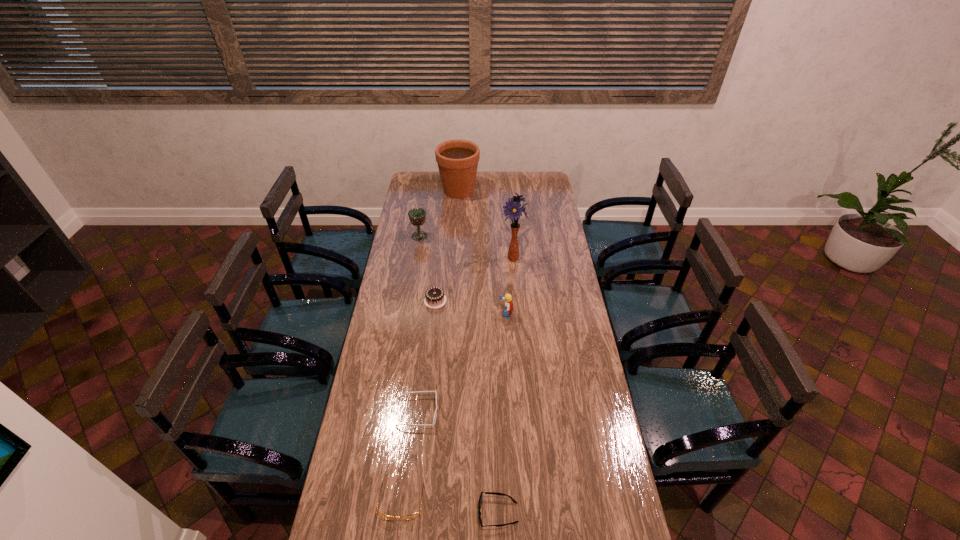
Identify the location of spectacles. (412, 516).

At what (x,y) coordinates should I click in order to perform the action: click on the right sunglasses. Please return your answer as a coordinate pair (x, y). Image resolution: width=960 pixels, height=540 pixels. Looking at the image, I should click on (494, 493).

Locate an element on the screen. This screenshot has height=540, width=960. the shortest object is located at coordinates (494, 493).

This screenshot has width=960, height=540. I want to click on vacant region located 0.100m on the back of the tallest object, so click(512, 237).

Locate an element on the screen. Image resolution: width=960 pixels, height=540 pixels. vacant space located on the left of the second tallest object is located at coordinates (428, 191).

Identify the location of vacant space located 0.090m on the front of the sixth shortest object. The image size is (960, 540). (417, 253).

The height and width of the screenshot is (540, 960). Find the location of `vacant region located on the front-facing side of the Lego`. vacant region located on the front-facing side of the Lego is located at coordinates (428, 314).

Where is `free space located on the front-facing side of the Lego`? Image resolution: width=960 pixels, height=540 pixels. free space located on the front-facing side of the Lego is located at coordinates (458, 314).

Locate an element on the screen. This screenshot has height=540, width=960. vacant space located on the front-facing side of the Lego is located at coordinates (420, 314).

Find the location of a particular element. This screenshot has width=960, height=540. vacant position located on the back of the chocolate cake is located at coordinates (439, 268).